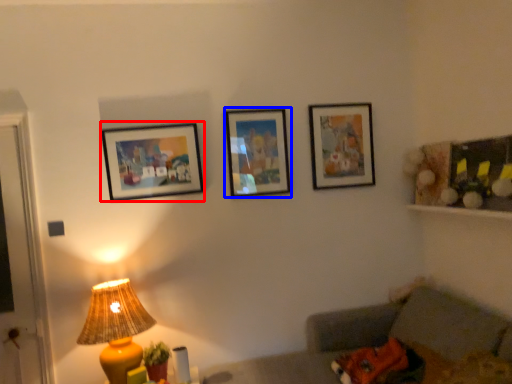
Question: Among these objects, which one is nearest to the camera, picture frame (highlighted by a red box) or picture frame (highlighted by a blue box)?

Choices:
 (A) picture frame
 (B) picture frame

Answer: (A)